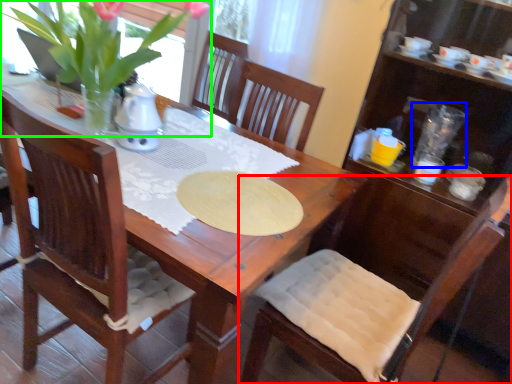
Question: Based on their relative distances, which object is nearer to chair (highlighted by a red box)? Choose from tableware (highlighted by a blue box) and houseplant (highlighted by a green box).

Choices:
 (A) tableware
 (B) houseplant

Answer: (A)